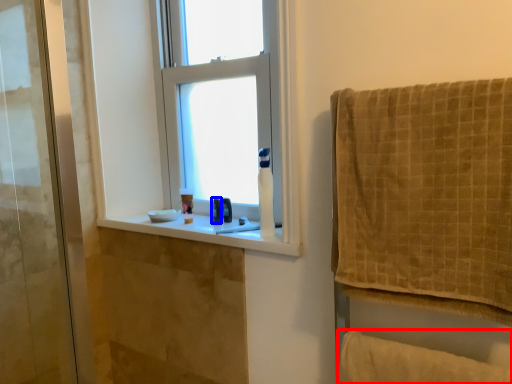
Question: Which object is further to the camera taking this photo, bath towel (highlighted by a red box) or toiletry (highlighted by a blue box)?

Choices:
 (A) bath towel
 (B) toiletry

Answer: (B)